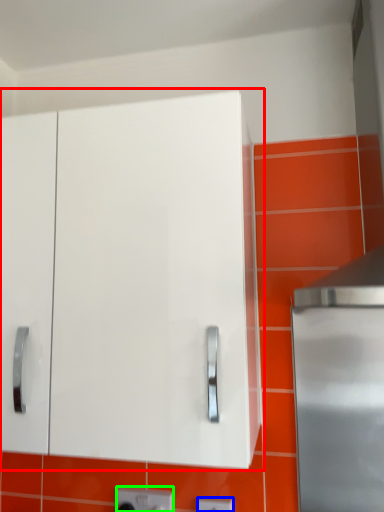
Question: Which is farther away from cabinetry (highlighted by a red box)? electric outlet (highlighted by a blue box) or electric outlet (highlighted by a green box)?

Choices:
 (A) electric outlet
 (B) electric outlet

Answer: (A)